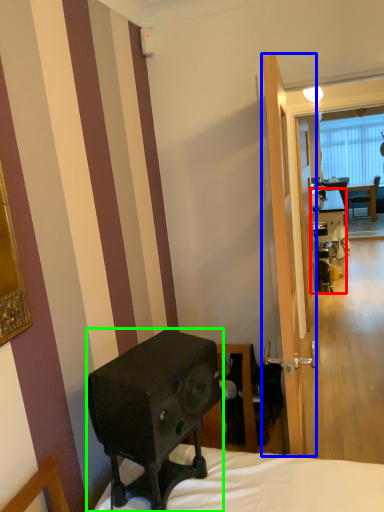
Question: Which object is the closest to the desk (highlighted by a red box)? Choose among these: screen door (highlighted by a blue box) or loudspeaker (highlighted by a green box).

Choices:
 (A) screen door
 (B) loudspeaker

Answer: (A)